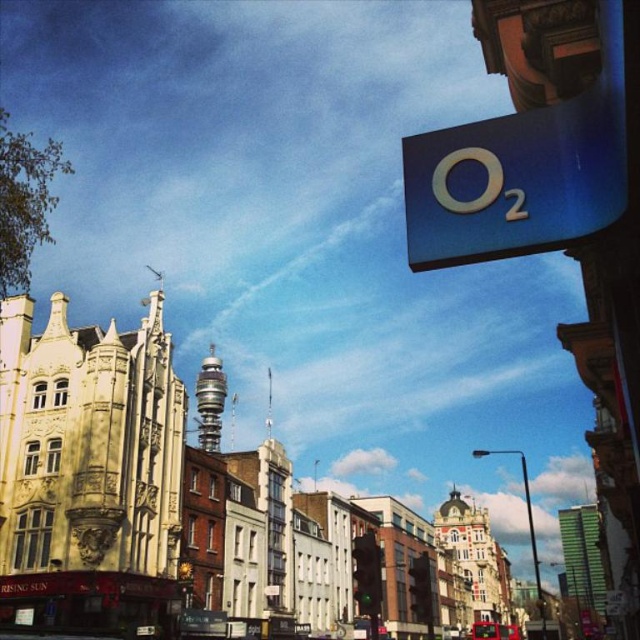
You are a delivery drone that needs to fly from the blue glossy sign at upper right to the metallic red bus at lower center. Can you safely descend vertically without hitting any obstacles?

The blue glossy sign at upper right has a lesser height compared to the metallic red bus at lower center. Since the sign is shorter, the drone can safely descend vertically to reach the bus without obstacles.

From the picture: You are a pedestrian standing on the sidewalk looking at the blue glossy sign at upper right and the metallic red bus at lower center. Which object is positioned to the left when viewed from your perspective?

The blue glossy sign at upper right is to the left of the metallic red bus at lower center, so it is positioned to the left when viewed from your perspective.